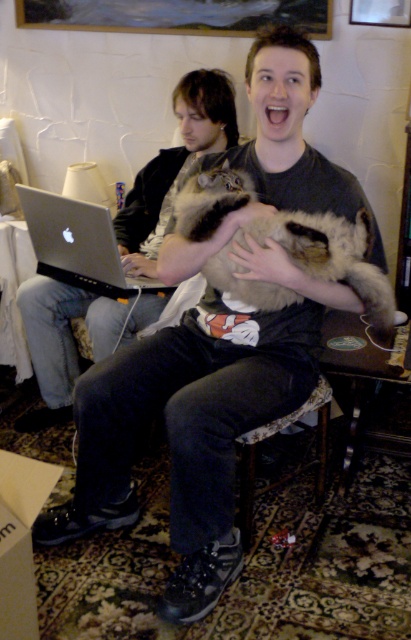
Question: Among these objects, which one is farthest from the camera?

Choices:
 (A) fuzzy fur cat at center
 (B) silver metallic laptop at left

Answer: (B)

Question: Is fuzzy fur cat at center in front of silver metallic laptop at left?

Choices:
 (A) no
 (B) yes

Answer: (B)

Question: Which of the following is the closest to the observer?

Choices:
 (A) silver metallic laptop at left
 (B) fuzzy fur cat at center
 (C) matte black laptop at left

Answer: (B)

Question: Does matte black laptop at left appear under silver metallic laptop at left?

Choices:
 (A) no
 (B) yes

Answer: (B)

Question: Is matte black laptop at left smaller than fuzzy fur cat at center?

Choices:
 (A) no
 (B) yes

Answer: (A)

Question: Which object appears closest to the camera in this image?

Choices:
 (A) silver metallic laptop at left
 (B) fuzzy fur cat at center
 (C) matte black laptop at left

Answer: (B)